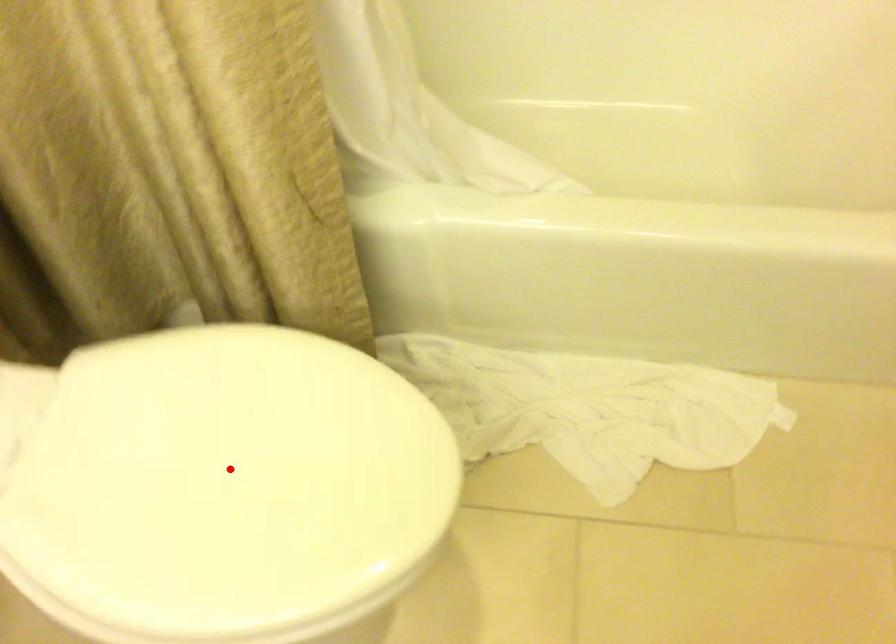
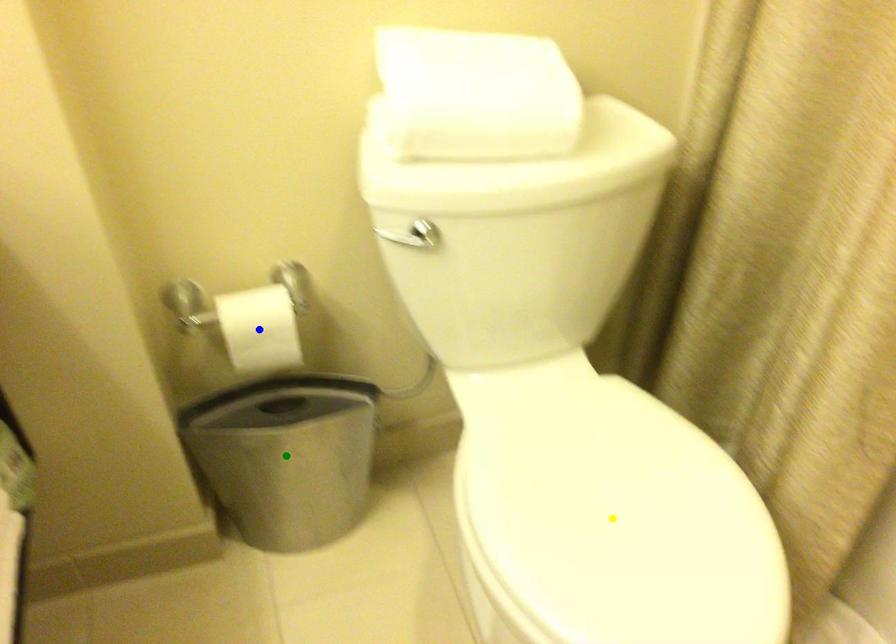
Question: I am providing you with two images of the same scene from different viewpoints. A red point is marked on the first image. You are given multiple points on the second image. Which point in image 2 represents the same 3d spot as the red point in image 1?

Choices:
 (A) yellow point
 (B) blue point
 (C) green point

Answer: (A)